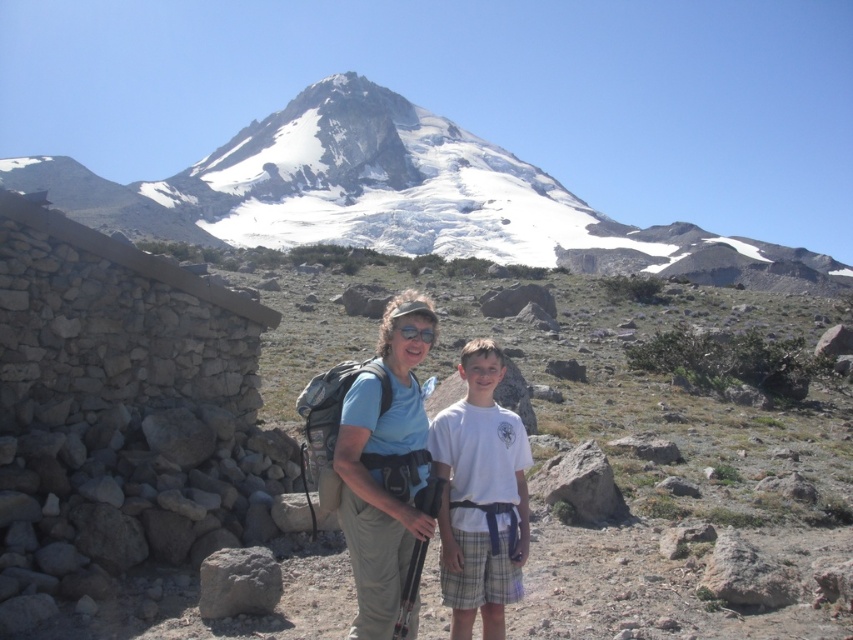
You are a photographer trying to capture both the matte blue shirt at center and the white cotton shirt at center in a single frame. Based on their sizes, which shirt should you position closer to the camera to ensure both appear equally sized in the photo?

The matte blue shirt at center has a lesser width compared to the white cotton shirt at center. To make them appear equally sized in the photo, position the matte blue shirt at center closer to the camera since it is smaller in width.

Consider the image. You are a photographer trying to capture both the matte blue shirt at center and the gray rough rock at lower left in a single frame. Based on their sizes, which object should you focus on to ensure both fit clearly in the photo?

The matte blue shirt at center is wider than the gray rough rock at lower left, so focusing on the matte blue shirt at center would help ensure both objects fit clearly in the frame.